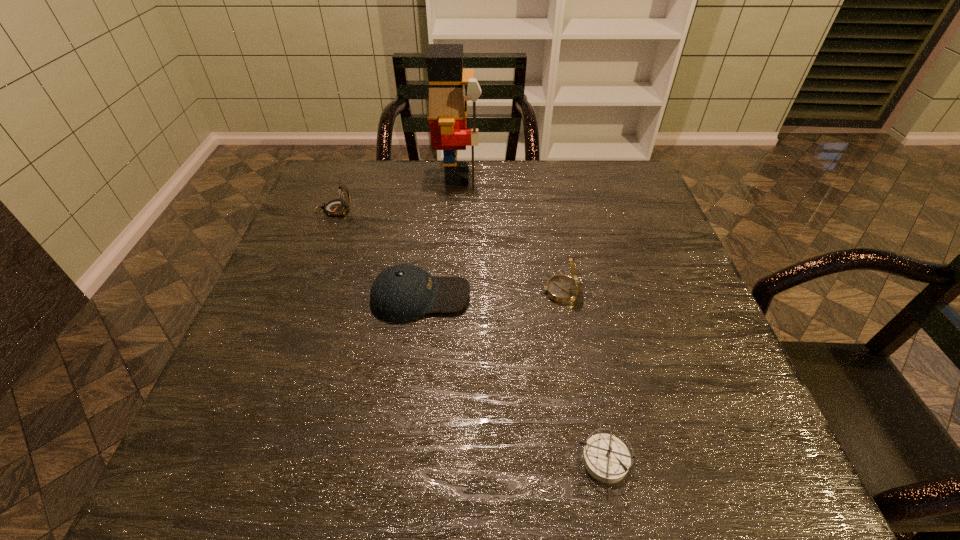
Where is `vacant space that satisfies the following two spatial constraints: 1. on the front-facing side of the shortest object; 2. on the right side of the second shortest object`? The image size is (960, 540). vacant space that satisfies the following two spatial constraints: 1. on the front-facing side of the shortest object; 2. on the right side of the second shortest object is located at coordinates (399, 460).

Where is `vacant space that satisfies the following two spatial constraints: 1. on the face of the leftmost compass; 2. on the back side of the nearest compass`? The width and height of the screenshot is (960, 540). vacant space that satisfies the following two spatial constraints: 1. on the face of the leftmost compass; 2. on the back side of the nearest compass is located at coordinates point(235,460).

This screenshot has height=540, width=960. What are the coordinates of `free region that satisfies the following two spatial constraints: 1. on the front-facing side of the nearest compass; 2. on the left side of the baseball cap` in the screenshot? It's located at (399, 460).

Locate an element on the screen. The image size is (960, 540). free space in the image that satisfies the following two spatial constraints: 1. in front of the farthest object holding the staff; 2. on the left side of the shortest object is located at coordinates (439, 460).

Image resolution: width=960 pixels, height=540 pixels. What are the coordinates of `vacant space that satisfies the following two spatial constraints: 1. in front of the farthest object holding the staff; 2. on the right side of the nearest compass` in the screenshot? It's located at (439, 460).

Where is `free space that satisfies the following two spatial constraints: 1. on the front-facing side of the fourth tallest object; 2. on the right side of the shortest compass`? This screenshot has height=540, width=960. free space that satisfies the following two spatial constraints: 1. on the front-facing side of the fourth tallest object; 2. on the right side of the shortest compass is located at coordinates (399, 460).